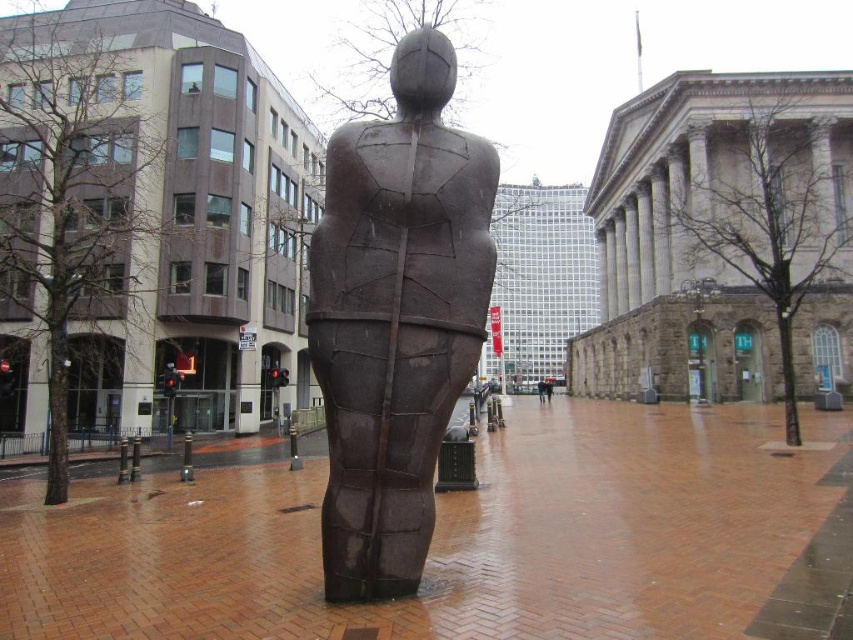
Question: Which object is closer to the camera taking this photo?

Choices:
 (A) brown matte statue at center
 (B) bronze textured sculpture at center

Answer: (B)

Question: Which object is closer to the camera taking this photo?

Choices:
 (A) dark brown statue at center
 (B) bronze textured sculpture at center

Answer: (B)

Question: Can you confirm if bronze textured sculpture at center is positioned below dark brown statue at center?

Choices:
 (A) yes
 (B) no

Answer: (B)

Question: Which object is the closest to the bronze textured sculpture at center?

Choices:
 (A) dark brown statue at center
 (B) brown matte statue at center

Answer: (A)

Question: Considering the relative positions of bronze textured sculpture at center and dark brown statue at center in the image provided, where is bronze textured sculpture at center located with respect to dark brown statue at center?

Choices:
 (A) left
 (B) right

Answer: (A)

Question: Where is bronze textured sculpture at center located in relation to brown matte statue at center in the image?

Choices:
 (A) left
 (B) right

Answer: (A)